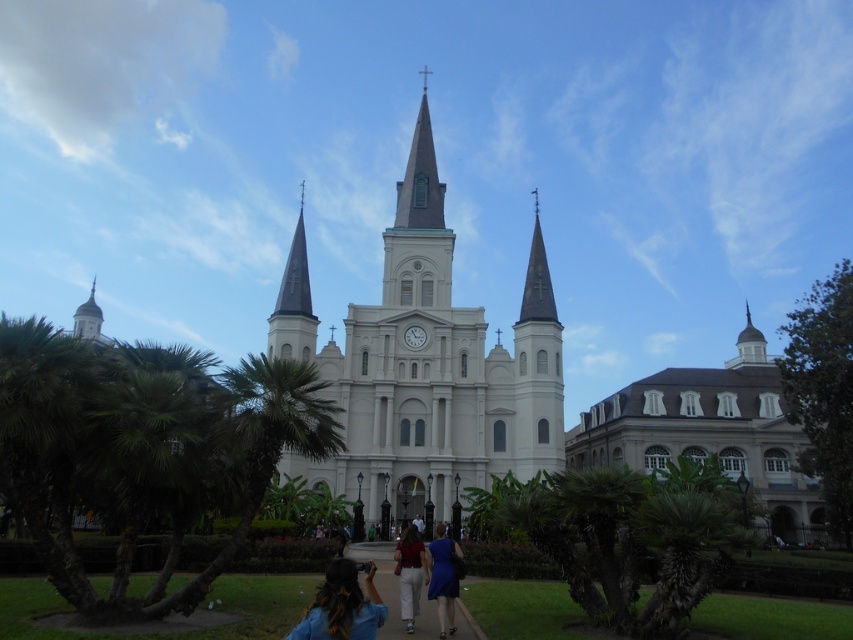
Question: Which object appears farthest from the camera in this image?

Choices:
 (A) white cotton pants at center
 (B) white stone church tower at center
 (C) dark brown hair at lower center
 (D) blue satin dress at lower center

Answer: (B)

Question: Does dark brown hair at lower center have a greater width compared to blue satin dress at lower center?

Choices:
 (A) no
 (B) yes

Answer: (B)

Question: Which point appears farthest from the camera in this image?

Choices:
 (A) (370, 625)
 (B) (422, 172)

Answer: (B)

Question: Among these points, which one is farthest from the camera?

Choices:
 (A) (345, 577)
 (B) (399, 540)

Answer: (B)

Question: Is white stone church tower at center positioned in front of blue satin dress at lower center?

Choices:
 (A) yes
 (B) no

Answer: (B)

Question: Where is dark brown hair at lower center located in relation to white cotton pants at center in the image?

Choices:
 (A) above
 (B) below

Answer: (B)